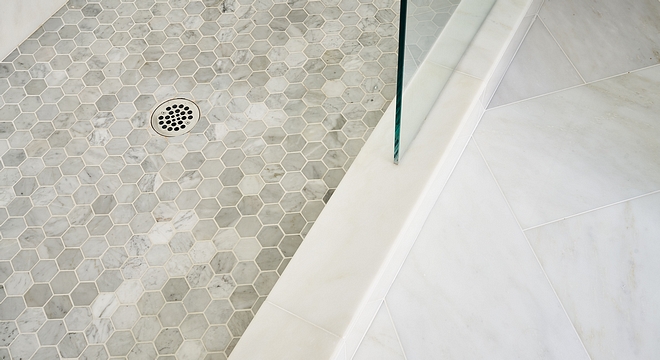
At what (x,y) coordinates should I click in order to perform the action: click on white marble tile. Please return your answer as a coordinate pair (x, y). The height and width of the screenshot is (360, 660). Looking at the image, I should click on (492, 274), (585, 127), (610, 288), (380, 347).